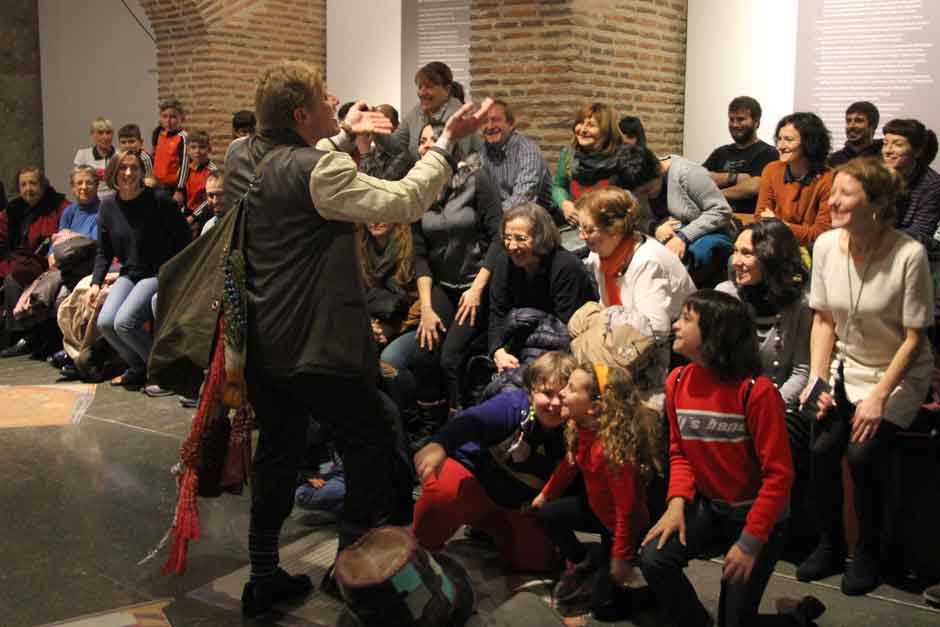
In order to click on brick pillar in this screenshot , I will do `click(619, 41)`, `click(216, 46)`.